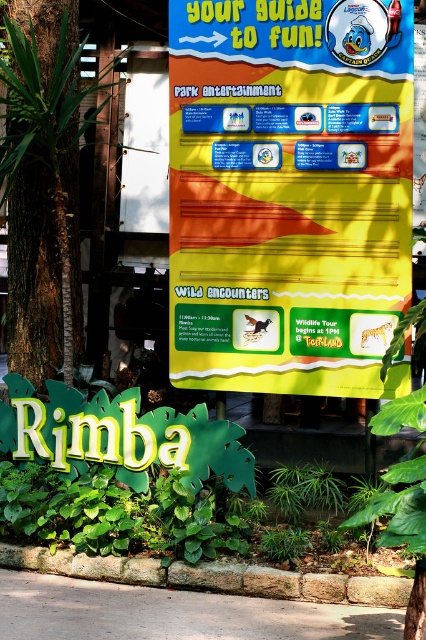
You are standing in front of the signboard titled Your Guide to Fun. You notice a point at coordinates point (287,163). If you want to touch this point with a stick that is 15 feet long, will the stick be long enough?

The distance of point (287,163) from camera is 18.94 feet, so the stick is not long enough to reach the point since it is shorter than the required distance.

You are standing in front of the signboard titled Your Guide to Fun. There are two points marked on the signboard at coordinates point (308,164) and point (69,237). If you were to draw a straight line between these two points, which point would be closer to you?

Point (308,164) is in front of point (69,237), so the point closer to you would be point (308,164).

You are standing in front of the theme park signboard and need to locate the yellow paper sign at center. According to the coordinates provided, where exactly is it positioned?

The yellow paper sign at center is located at point (290,193).